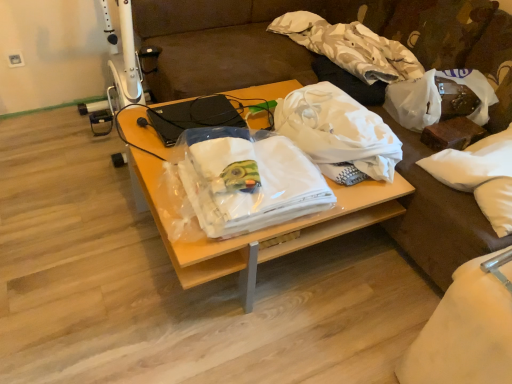
The width and height of the screenshot is (512, 384). Describe the element at coordinates (247, 179) in the screenshot. I see `white fabric at center, placed as the first cloth when sorted from front to back` at that location.

The width and height of the screenshot is (512, 384). Find the location of `white cotton cloth at upper center, which appears as the 2th cloth when viewed from the front`. white cotton cloth at upper center, which appears as the 2th cloth when viewed from the front is located at coordinates (350, 47).

The image size is (512, 384). Describe the element at coordinates (350, 47) in the screenshot. I see `white cotton cloth at upper center, placed as the 2th cloth when sorted from bottom to top` at that location.

Identify the location of white plastic power outlet at upper left. (15, 59).

What do you see at coordinates (257, 230) in the screenshot? I see `white fabric at center` at bounding box center [257, 230].

The height and width of the screenshot is (384, 512). Describe the element at coordinates (193, 117) in the screenshot. I see `black matte laptop at center` at that location.

Locate an element on the screen. Image resolution: width=512 pixels, height=384 pixels. white soft pillow at right is located at coordinates (472, 162).

Is white matte plastic bag at center, which is counted as the first plastic bag, starting from the left, surrounded by black matte laptop at center?

No.

Which is in front, point (232, 116) or point (322, 153)?

Positioned in front is point (322, 153).

Is white matte plastic bag at center, which appears as the 2th plastic bag when viewed from the right, at the back of black matte laptop at center?

No, black matte laptop at center's orientation is not away from white matte plastic bag at center, which appears as the 2th plastic bag when viewed from the right.

Looking at this image, from the image's perspective, which is above, white plastic power outlet at upper left or white fabric couch at center?

white plastic power outlet at upper left is shown above in the image.

Where is `studio couch below the white plastic power outlet at upper left (from the image's perspective)`? studio couch below the white plastic power outlet at upper left (from the image's perspective) is located at coordinates tap(256, 40).

Is white fabric couch at center a part of white plastic power outlet at upper left?

No, white fabric couch at center is not surrounded by white plastic power outlet at upper left.

In terms of height, does white plastic power outlet at upper left look taller or shorter compared to white fabric couch at center?

In the image, white plastic power outlet at upper left appears to be taller than white fabric couch at center.

Could white fabric at center be considered to be inside white plastic power outlet at upper left?

No, white fabric at center is located outside of white plastic power outlet at upper left.

Does white plastic power outlet at upper left have a lesser height compared to white fabric at center?

Indeed, white plastic power outlet at upper left has a lesser height compared to white fabric at center.

Which point is more forward, [15,55] or [266,92]?

The point [266,92] is more forward.

Considering the sizes of objects white fabric couch at center and white fabric at center in the image provided, who is taller, white fabric couch at center or white fabric at center?

With more height is white fabric at center.

Is white fabric couch at center turned away from white fabric at center?

No, white fabric couch at center's orientation is not away from white fabric at center.

The height and width of the screenshot is (384, 512). I want to click on studio couch that is under the white fabric at center (from a real-world perspective), so click(x=256, y=40).

Does point (342, 10) come in front of point (285, 250)?

That is False.

Looking at this image, are white plastic power outlet at upper left and white fabric at center, the 2th cloth viewed from the top, located far from each other?

Yes, white plastic power outlet at upper left is far from white fabric at center, the 2th cloth viewed from the top.

Considering the relative sizes of white plastic power outlet at upper left and white fabric at center, placed as the first cloth when sorted from front to back, in the image provided, is white plastic power outlet at upper left smaller than white fabric at center, placed as the first cloth when sorted from front to back,?

Correct, white plastic power outlet at upper left occupies less space than white fabric at center, placed as the first cloth when sorted from front to back.

Which of these two, white plastic power outlet at upper left or white fabric at center, which is counted as the 1th cloth, starting from the bottom, is thinner?

white plastic power outlet at upper left is thinner.

Can you confirm if white plastic power outlet at upper left is positioned to the left of white fabric at center, which is counted as the 1th cloth, starting from the bottom?

Yes.

Could you tell me if white matte plastic bag at upper right, acting as the first plastic bag starting from the right, is turned towards black matte laptop at center?

Yes, white matte plastic bag at upper right, acting as the first plastic bag starting from the right, is oriented towards black matte laptop at center.

Consider the image. Is white matte plastic bag at upper right, which is the 2th plastic bag from left to right, next to black matte laptop at center?

No.

Is white matte plastic bag at upper right, which is the 2th plastic bag from left to right, to the right of black matte laptop at center from the viewer's perspective?

Indeed, white matte plastic bag at upper right, which is the 2th plastic bag from left to right, is positioned on the right side of black matte laptop at center.

Which object is more forward, white matte plastic bag at upper right, which is the 2th plastic bag from left to right, or black matte laptop at center?

white matte plastic bag at upper right, which is the 2th plastic bag from left to right, is in front.

Between white matte plastic bag at upper right, acting as the first plastic bag starting from the right, and white matte plastic bag at center, which is counted as the first plastic bag, starting from the left, which one has smaller size?

white matte plastic bag at upper right, acting as the first plastic bag starting from the right.

Which object is closer to the camera taking this photo, white matte plastic bag at upper right, acting as the first plastic bag starting from the right, or white matte plastic bag at center, which is counted as the first plastic bag, starting from the left?

white matte plastic bag at center, which is counted as the first plastic bag, starting from the left, is closer to the camera.

Locate an element on the screen. plastic bag located above the white matte plastic bag at center, which is counted as the first plastic bag, starting from the left (from the image's perspective) is located at coordinates (435, 98).

Is point (431, 112) more distant than point (380, 154)?

That is True.

You are a GUI agent. You are given a task and a screenshot of the screen. Output one action in this format:
    pyautogui.click(x=<x>, y=<y>)
    Task: Click on the laptop on the left side of white matte plastic bag at center, which appears as the 2th plastic bag when viewed from the right
    The width and height of the screenshot is (512, 384).
    Given the screenshot: What is the action you would take?
    click(x=193, y=117)

Find the location of a particular element. power outlet behind the white fabric couch at center is located at coordinates (15, 59).

From the picture: Estimate the real-world distances between objects in this image. Which object is closer to white matte plastic bag at center, which appears as the 2th plastic bag when viewed from the right, white fabric at center, which is counted as the second cloth, starting from the back, or white soft pillow at right?

white fabric at center, which is counted as the second cloth, starting from the back.

From the picture: When comparing their distances from white soft pillow at right, does white matte plastic bag at upper right, which is the 2th plastic bag from left to right, or white cotton cloth at upper center, positioned as the 1th cloth in back-to-front order, seem closer?

white matte plastic bag at upper right, which is the 2th plastic bag from left to right.

Estimate the real-world distances between objects in this image. Which object is closer to white matte plastic bag at upper right, acting as the first plastic bag starting from the right, white matte plastic bag at center, which appears as the 2th plastic bag when viewed from the right, or white fabric at center?

The object closer to white matte plastic bag at upper right, acting as the first plastic bag starting from the right, is white matte plastic bag at center, which appears as the 2th plastic bag when viewed from the right.

Which object lies further to the anchor point white plastic power outlet at upper left, white matte plastic bag at upper right, which is the 2th plastic bag from left to right, or white cotton cloth at upper center, placed as the 2th cloth when sorted from bottom to top?

white matte plastic bag at upper right, which is the 2th plastic bag from left to right, lies further to white plastic power outlet at upper left than the other object.

Which object lies nearer to the anchor point black matte laptop at center, white matte plastic bag at upper right, acting as the first plastic bag starting from the right, or white fabric couch at center?

white fabric couch at center is positioned closer to the anchor black matte laptop at center.

Estimate the real-world distances between objects in this image. Which object is further from black matte laptop at center, white cotton cloth at upper center, positioned as the 1th cloth in back-to-front order, or white soft pillow at right?

white soft pillow at right lies further to black matte laptop at center than the other object.

Which object lies nearer to the anchor point white matte plastic bag at upper right, acting as the first plastic bag starting from the right, white soft pillow at right or white fabric at center?

The object closer to white matte plastic bag at upper right, acting as the first plastic bag starting from the right, is white soft pillow at right.

Considering their positions, is white matte plastic bag at upper right, which is the 2th plastic bag from left to right, positioned closer to white cotton cloth at upper center, placed as the 2th cloth when sorted from bottom to top, than white matte plastic bag at center, which appears as the 2th plastic bag when viewed from the right?

white matte plastic bag at upper right, which is the 2th plastic bag from left to right, lies closer to white cotton cloth at upper center, placed as the 2th cloth when sorted from bottom to top, than the other object.

This screenshot has width=512, height=384. In order to click on laptop between white cotton cloth at upper center, the first cloth from the top, and white fabric at center, placed as the first cloth when sorted from front to back, in the vertical direction in this screenshot , I will do `click(193, 117)`.

I want to click on desk located between white fabric couch at center and white soft pillow at right in the left-right direction, so click(x=257, y=230).

Locate an element on the screen. The height and width of the screenshot is (384, 512). studio couch situated between black matte laptop at center and white soft pillow at right from left to right is located at coordinates (256, 40).

Find the location of `desk between white plastic power outlet at upper left and white soft pillow at right in the horizontal direction`. desk between white plastic power outlet at upper left and white soft pillow at right in the horizontal direction is located at coordinates (257, 230).